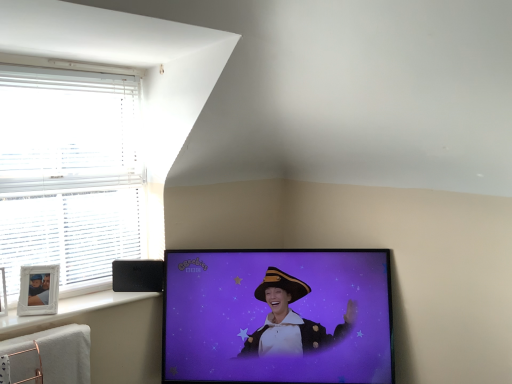
The width and height of the screenshot is (512, 384). Identify the location of free point above white plastic frame at lower left (from a real-world perspective). (84, 301).